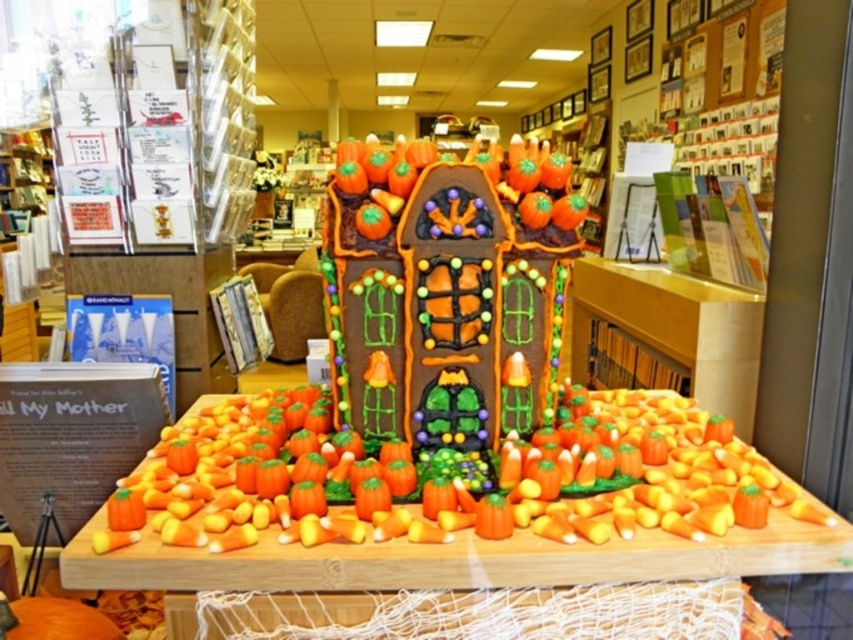
Question: Does candy-coated pumpkin house at center appear on the right side of orange matte pumpkin at center?

Choices:
 (A) yes
 (B) no

Answer: (A)

Question: Is candy-coated pumpkin house at center to the right of orange matte pumpkin at center from the viewer's perspective?

Choices:
 (A) no
 (B) yes

Answer: (B)

Question: Does candy-coated pumpkin house at center have a lesser width compared to orange matte pumpkin at center?

Choices:
 (A) yes
 (B) no

Answer: (B)

Question: Which object is closer to the camera taking this photo?

Choices:
 (A) orange matte pumpkin at center
 (B) candy-coated pumpkin house at center

Answer: (B)

Question: Which point appears farthest from the camera in this image?

Choices:
 (A) (73, 625)
 (B) (590, 401)

Answer: (B)